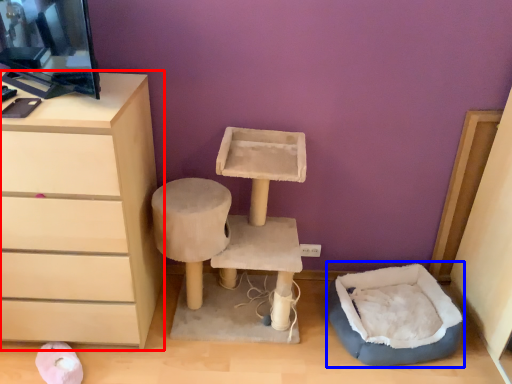
Question: Which point is further to the camera, chest of drawers (highlighted by a red box) or bean bag chair (highlighted by a blue box)?

Choices:
 (A) chest of drawers
 (B) bean bag chair

Answer: (B)